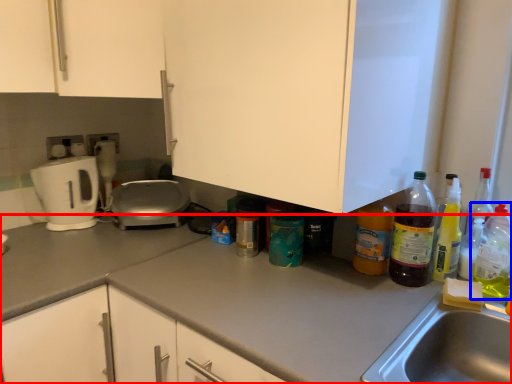
Question: Which object is further to the camera taking this photo, countertop (highlighted by a red box) or bottle (highlighted by a blue box)?

Choices:
 (A) countertop
 (B) bottle

Answer: (B)